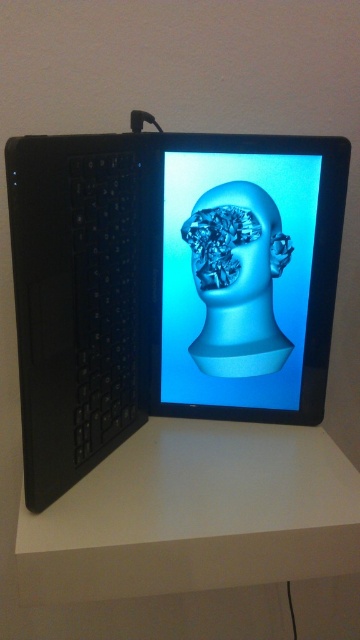
Is point (312, 509) farther from camera compared to point (248, 387)?

That is False.

Which is more to the left, white matte table at center or transparent plastic head at center?

white matte table at center is more to the left.

What do you see at coordinates (195, 529) in the screenshot? The width and height of the screenshot is (360, 640). I see `white matte table at center` at bounding box center [195, 529].

You are a GUI agent. You are given a task and a screenshot of the screen. Output one action in this format:
    pyautogui.click(x=<x>, y=<y>)
    Task: Click on the white matte table at center
    This screenshot has height=640, width=360.
    Given the screenshot: What is the action you would take?
    pyautogui.click(x=195, y=529)

Is point (72, 317) positioned in front of point (158, 616)?

Yes, it is in front of point (158, 616).

Is black matte laptop at center wider than white matte table at center?

No.

Does point (335, 275) lie in front of point (90, 548)?

No, (335, 275) is further to viewer.

This screenshot has height=640, width=360. What are the coordinates of `black matte laptop at center` in the screenshot? It's located at (146, 294).

Who is positioned more to the left, white matte table at center or translucent blue sculpture at center?

white matte table at center

Does white matte table at center appear on the left side of translucent blue sculpture at center?

Correct, you'll find white matte table at center to the left of translucent blue sculpture at center.

Identify the location of white matte table at center. (195, 529).